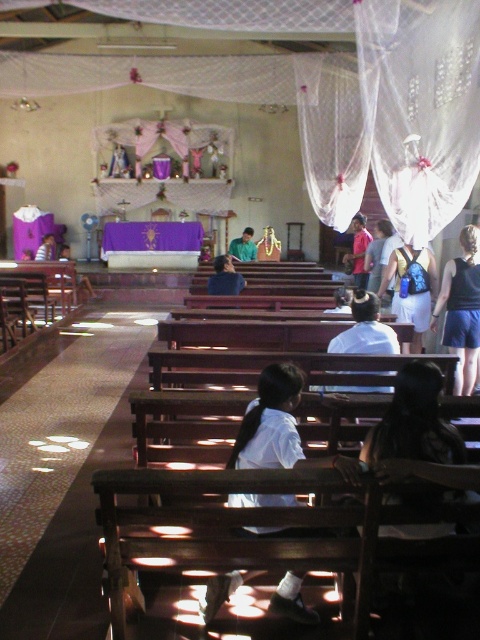
Question: Which object appears farthest from the camera in this image?

Choices:
 (A) matte black laptop at left
 (B) blue denim shorts at lower right

Answer: (A)

Question: Is white fabric backpack at center wider than pink fabric at center?

Choices:
 (A) yes
 (B) no

Answer: (A)

Question: Can you confirm if white fabric backpack at center is positioned to the left of pink fabric at center?

Choices:
 (A) yes
 (B) no

Answer: (B)

Question: Does white matte shirt at center appear under blue denim shorts at lower right?

Choices:
 (A) no
 (B) yes

Answer: (B)

Question: Which object is closer to the camera taking this photo?

Choices:
 (A) white matte shirt at center
 (B) white shirt at center
 (C) pink fabric at center

Answer: (A)

Question: Considering the real-world distances, which object is farthest from the white matte shirt at center?

Choices:
 (A) matte black laptop at left
 (B) green matte shirt at center

Answer: (A)